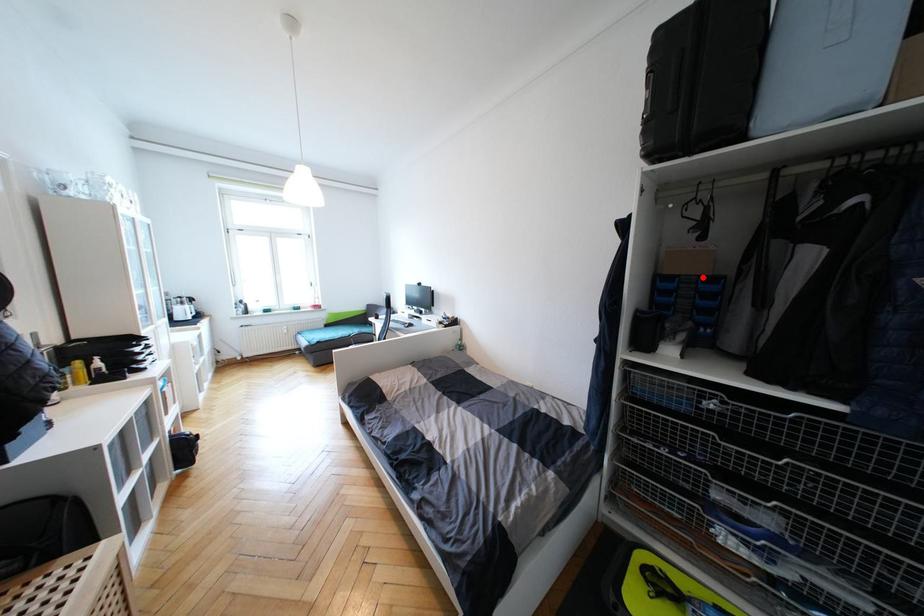
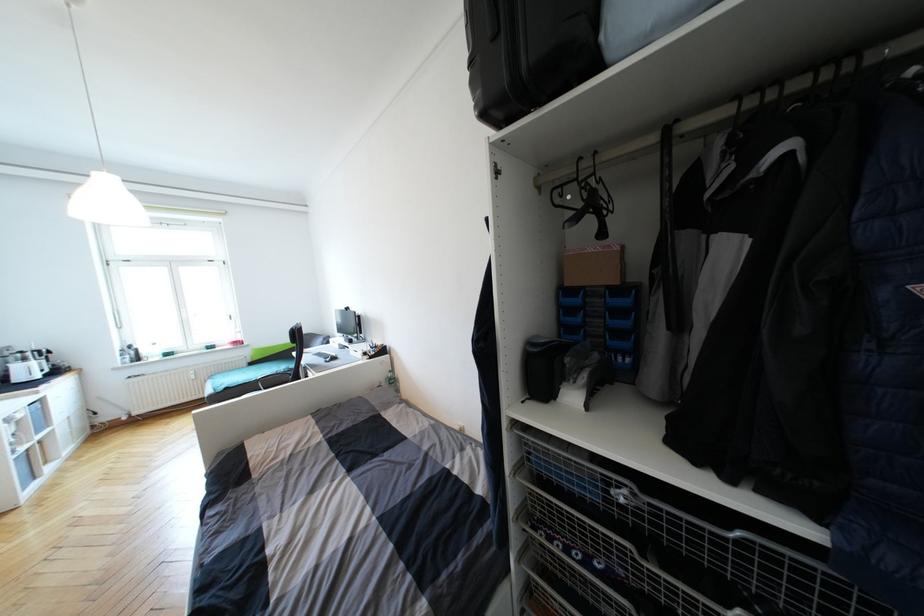
Locate, in the second image, the point that corresponds to the highlighted location in the first image.

(611, 288)